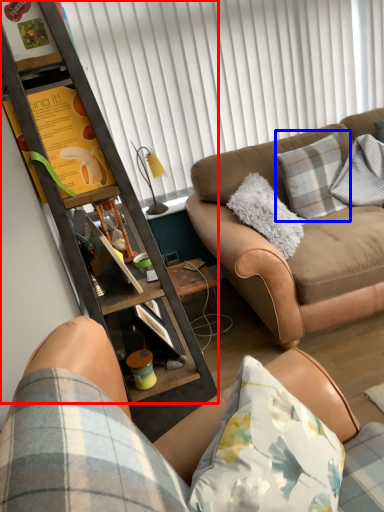
Question: Which object is further to the camera taking this photo, cabinetry (highlighted by a red box) or pillow (highlighted by a blue box)?

Choices:
 (A) cabinetry
 (B) pillow

Answer: (B)